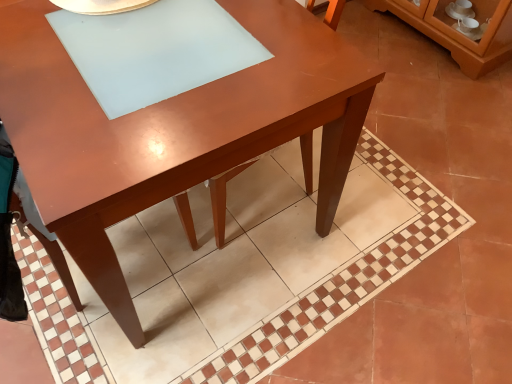
Question: In terms of height, does matte brown table at center look taller or shorter compared to brown glossy cabinet at upper right?

Choices:
 (A) tall
 (B) short

Answer: (A)

Question: Considering the positions of point pyautogui.click(x=88, y=226) and point pyautogui.click(x=426, y=21), is point pyautogui.click(x=88, y=226) closer or farther from the camera than point pyautogui.click(x=426, y=21)?

Choices:
 (A) farther
 (B) closer

Answer: (B)

Question: From a real-world perspective, is matte brown table at center above or below brown glossy cabinet at upper right?

Choices:
 (A) above
 (B) below

Answer: (A)

Question: Would you say brown glossy cabinet at upper right is inside or outside matte brown table at center?

Choices:
 (A) outside
 (B) inside

Answer: (A)

Question: From a real-world perspective, is brown glossy cabinet at upper right physically located above or below matte brown table at center?

Choices:
 (A) above
 (B) below

Answer: (B)

Question: Is brown glossy cabinet at upper right wider or thinner than matte brown table at center?

Choices:
 (A) wide
 (B) thin

Answer: (B)

Question: Based on their positions, is brown glossy cabinet at upper right located to the left or right of matte brown table at center?

Choices:
 (A) right
 (B) left

Answer: (A)